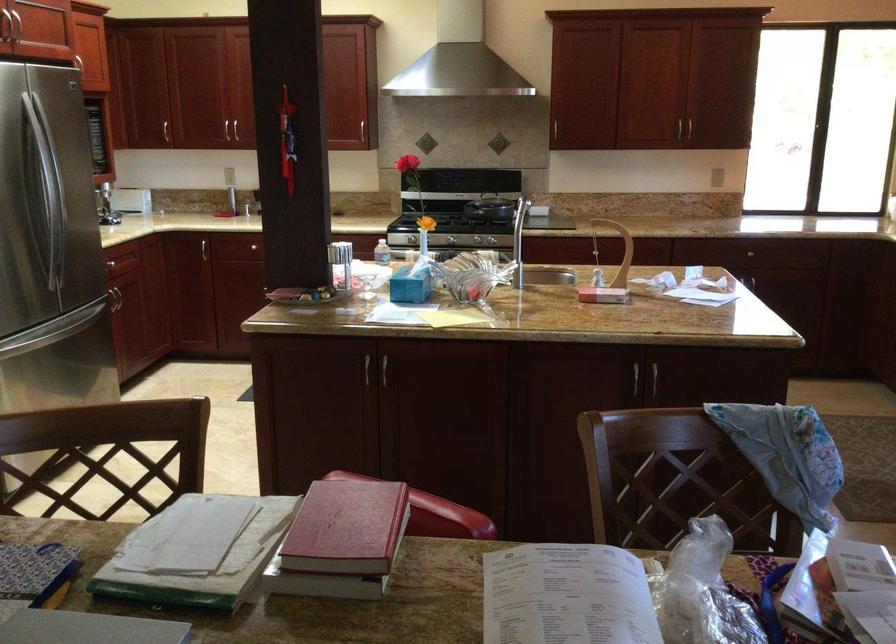
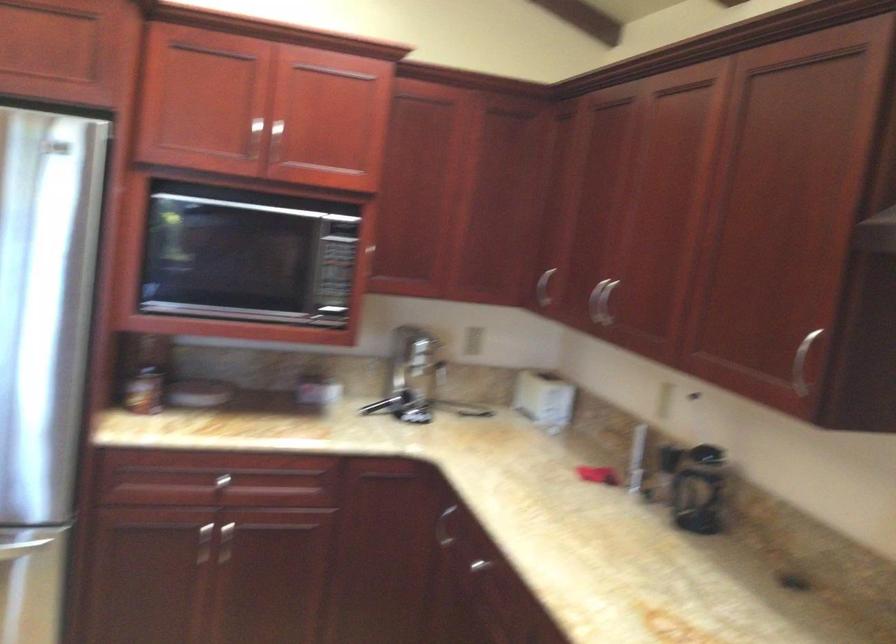
Locate, in the second image, the point that corresponds to (x=185, y=120) in the first image.

(600, 301)